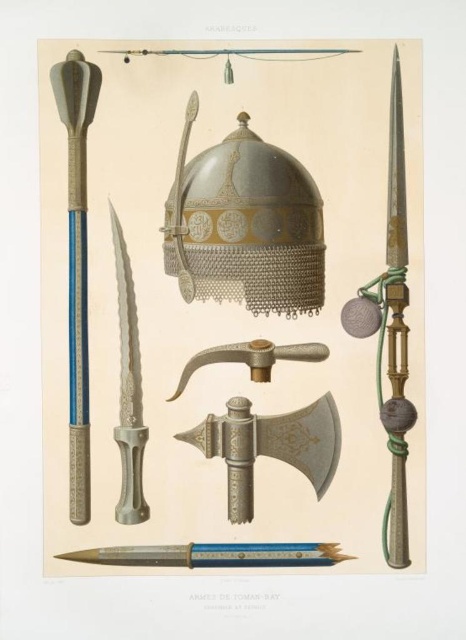
Question: Which point is farther to the camera?

Choices:
 (A) polished silver dagger at center
 (B) silver metallic dagger at center-left
 (C) metallic chainmail helmet at center
 (D) brushed metal sword at left

Answer: (A)

Question: Which point appears closest to the camera in this image?

Choices:
 (A) (326, 468)
 (B) (87, 336)

Answer: (B)

Question: Does metallic chainmail helmet at center appear over silver metallic dagger at center-left?

Choices:
 (A) no
 (B) yes

Answer: (B)

Question: Which object is the farthest from the silver metallic dagger at center-left?

Choices:
 (A) polished silver dagger at center
 (B) brushed metal sword at left
 (C) metallic chainmail helmet at center

Answer: (C)

Question: Does polished silver dagger at center appear under silver metallic dagger at center-left?

Choices:
 (A) yes
 (B) no

Answer: (A)

Question: Is the position of metallic chainmail helmet at center more distant than that of polished silver dagger at center?

Choices:
 (A) yes
 (B) no

Answer: (B)